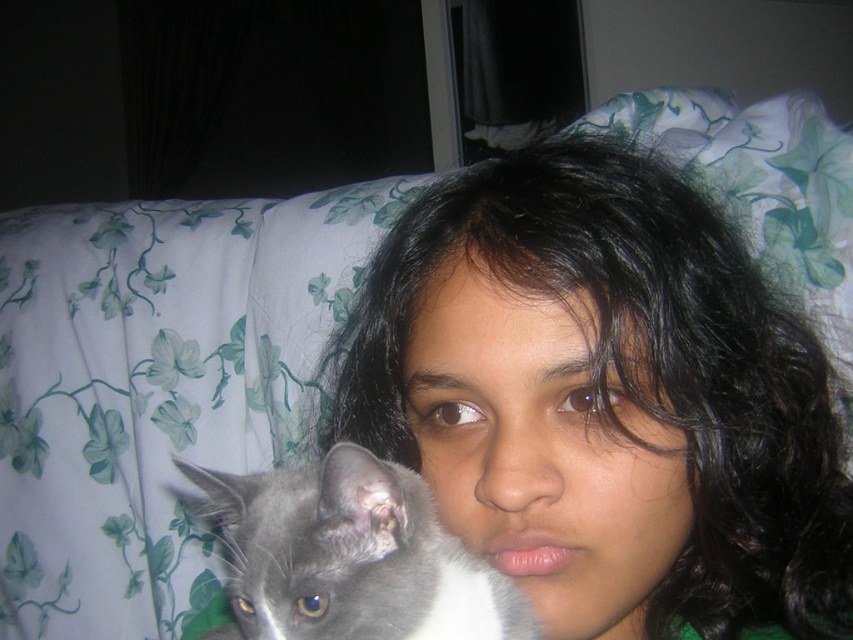
Question: Which object appears closest to the camera in this image?

Choices:
 (A) gray soft fur cat at lower left
 (B) black matte hair at center

Answer: (A)

Question: Considering the relative positions of black matte hair at center and gray soft fur cat at lower left in the image provided, where is black matte hair at center located with respect to gray soft fur cat at lower left?

Choices:
 (A) below
 (B) above

Answer: (B)

Question: Which point is closer to the camera taking this photo?

Choices:
 (A) (392, 596)
 (B) (807, 509)

Answer: (A)

Question: Observing the image, what is the correct spatial positioning of black matte hair at center in reference to gray soft fur cat at lower left?

Choices:
 (A) above
 (B) below

Answer: (A)

Question: Which of the following is the closest to the observer?

Choices:
 (A) (260, 621)
 (B) (490, 506)

Answer: (A)

Question: Can you confirm if black matte hair at center is positioned to the right of gray soft fur cat at lower left?

Choices:
 (A) yes
 (B) no

Answer: (A)